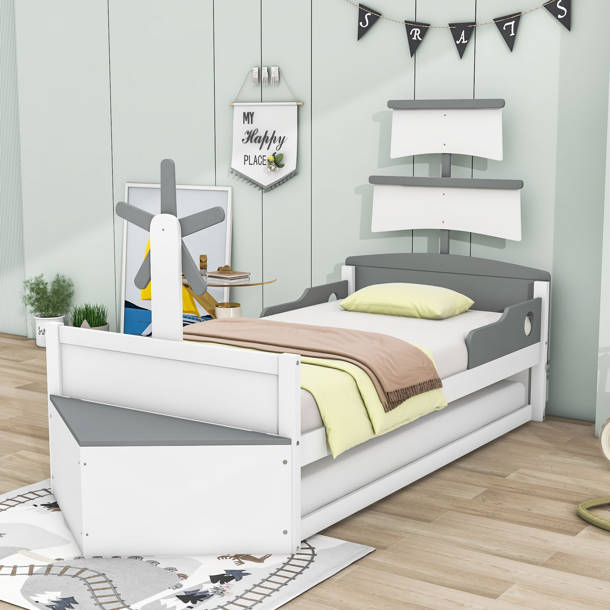
Identify the location of headboard. (463, 282).